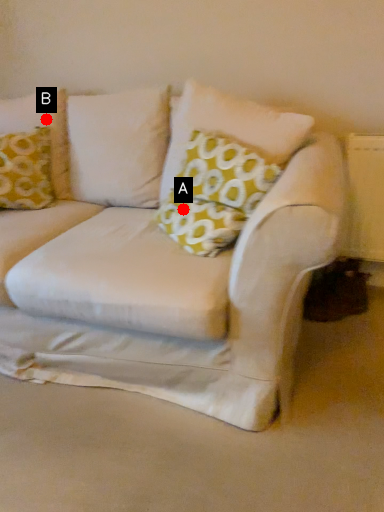
Question: Two points are circled on the image, labeled by A and B beside each circle. Among these points, which one is nearest to the camera?

Choices:
 (A) A is closer
 (B) B is closer

Answer: (A)